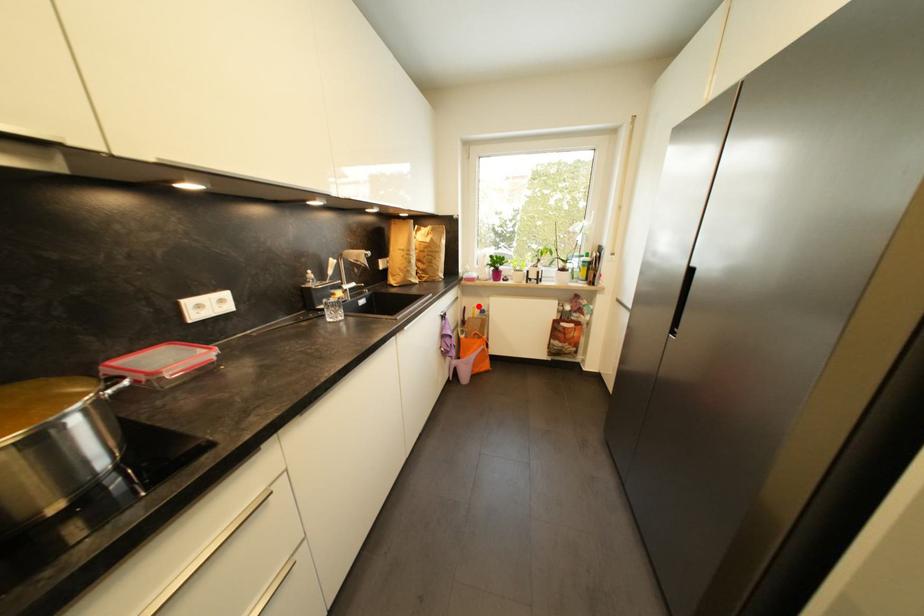
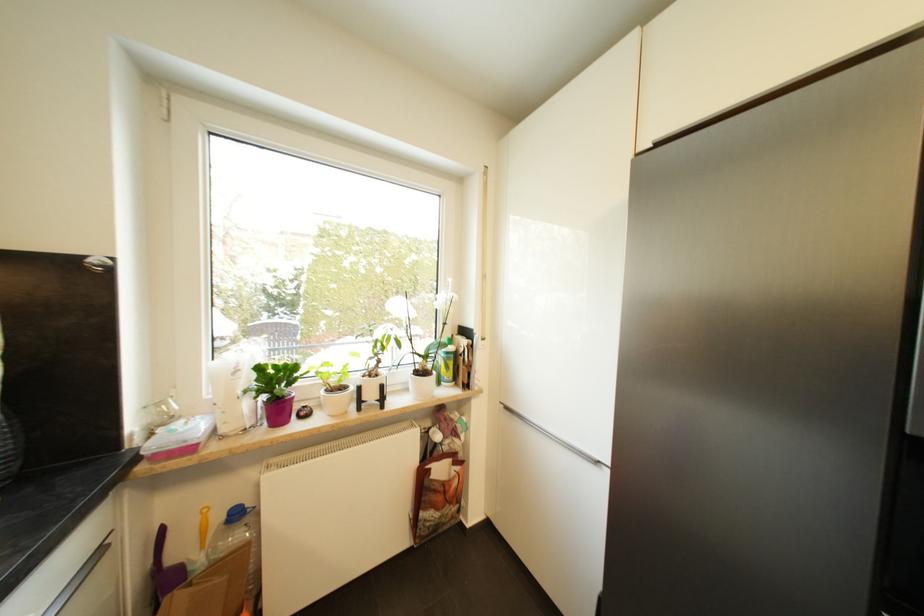
Locate, in the second image, the point that corresponds to the highlighted location in the first image.

(207, 507)